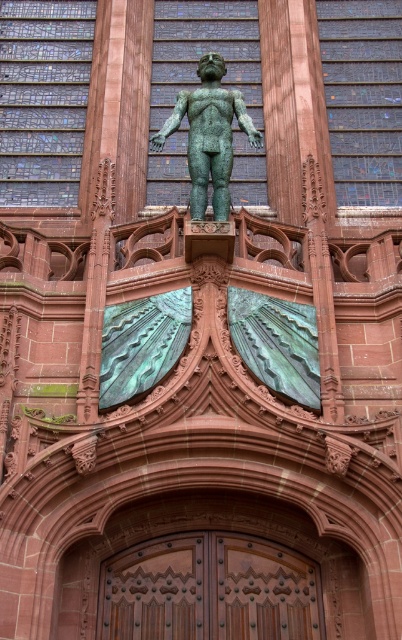
Question: Which point appears farthest from the camera in this image?

Choices:
 (A) [151, 572]
 (B) [201, 93]

Answer: (B)

Question: Observing the image, what is the correct spatial positioning of polished wood doors at center in reference to green patinated bronze statue at upper center?

Choices:
 (A) above
 (B) below

Answer: (B)

Question: Where is polished wood doors at center located in relation to green patinated bronze statue at upper center in the image?

Choices:
 (A) right
 (B) left

Answer: (A)

Question: Is polished wood doors at center to the left of green patinated bronze statue at upper center from the viewer's perspective?

Choices:
 (A) yes
 (B) no

Answer: (B)

Question: Which object is closer to the camera taking this photo?

Choices:
 (A) polished wood doors at center
 (B) green patinated bronze statue at upper center

Answer: (A)